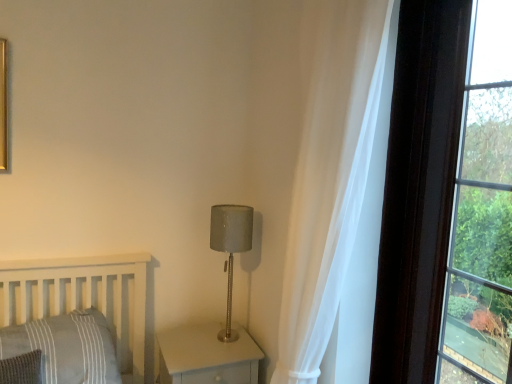
Question: Would you say satin gray lampshade at center is part of matte gray wood nightstand at lower center's contents?

Choices:
 (A) yes
 (B) no

Answer: (B)

Question: Is the surface of matte gray wood nightstand at lower center in direct contact with satin gray lampshade at center?

Choices:
 (A) yes
 (B) no

Answer: (B)

Question: Is matte gray wood nightstand at lower center at the left side of satin gray lampshade at center?

Choices:
 (A) yes
 (B) no

Answer: (A)

Question: Can you confirm if matte gray wood nightstand at lower center is shorter than satin gray lampshade at center?

Choices:
 (A) yes
 (B) no

Answer: (A)

Question: Is matte gray wood nightstand at lower center further to camera compared to satin gray lampshade at center?

Choices:
 (A) yes
 (B) no

Answer: (B)

Question: Does matte gray wood nightstand at lower center turn towards satin gray lampshade at center?

Choices:
 (A) no
 (B) yes

Answer: (A)

Question: Is gray striped pillow at lower left positioned behind dark brown wood frame at right?

Choices:
 (A) no
 (B) yes

Answer: (B)

Question: Does gray striped pillow at lower left turn towards dark brown wood frame at right?

Choices:
 (A) no
 (B) yes

Answer: (A)

Question: From the image's perspective, does gray striped pillow at lower left appear higher than dark brown wood frame at right?

Choices:
 (A) no
 (B) yes

Answer: (A)

Question: Does gray striped pillow at lower left have a greater height compared to dark brown wood frame at right?

Choices:
 (A) yes
 (B) no

Answer: (B)

Question: Does gray striped pillow at lower left appear on the right side of dark brown wood frame at right?

Choices:
 (A) no
 (B) yes

Answer: (A)

Question: Is gray striped pillow at lower left surrounding dark brown wood frame at right?

Choices:
 (A) no
 (B) yes

Answer: (A)

Question: Is white sheer curtain at right looking in the opposite direction of gray striped pillow at lower left?

Choices:
 (A) yes
 (B) no

Answer: (B)